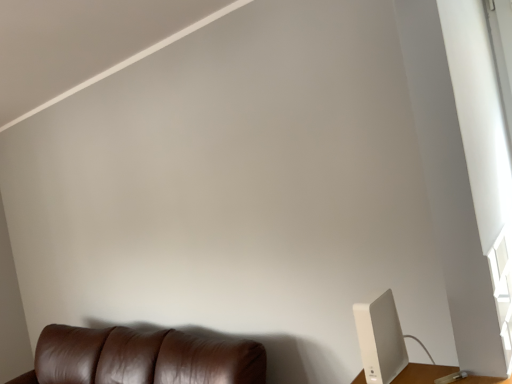
Question: Would you say white plastic router at lower right is outside brown leather couch at lower left?

Choices:
 (A) no
 (B) yes

Answer: (B)

Question: Is white plastic router at lower right looking in the opposite direction of brown leather couch at lower left?

Choices:
 (A) no
 (B) yes

Answer: (A)

Question: Is white plastic router at lower right wider than brown leather couch at lower left?

Choices:
 (A) yes
 (B) no

Answer: (B)

Question: Is white plastic router at lower right next to brown leather couch at lower left and touching it?

Choices:
 (A) yes
 (B) no

Answer: (B)

Question: From a real-world perspective, is white plastic router at lower right beneath brown leather couch at lower left?

Choices:
 (A) no
 (B) yes

Answer: (A)

Question: Is white plastic router at lower right at the right side of brown leather couch at lower left?

Choices:
 (A) yes
 (B) no

Answer: (A)

Question: Would you say white plastic router at lower right is part of brown leather couch at lower left's contents?

Choices:
 (A) yes
 (B) no

Answer: (B)

Question: From a real-world perspective, does brown leather couch at lower left sit lower than white plastic router at lower right?

Choices:
 (A) no
 (B) yes

Answer: (B)

Question: Would you say brown leather couch at lower left is outside white plastic router at lower right?

Choices:
 (A) yes
 (B) no

Answer: (A)

Question: Is the position of brown leather couch at lower left more distant than that of white plastic router at lower right?

Choices:
 (A) no
 (B) yes

Answer: (B)

Question: Can you confirm if brown leather couch at lower left is positioned to the left of white plastic router at lower right?

Choices:
 (A) no
 (B) yes

Answer: (B)

Question: Is there a large distance between brown leather couch at lower left and white plastic router at lower right?

Choices:
 (A) no
 (B) yes

Answer: (B)

Question: From the image's perspective, is white plastic router at lower right above or below brown leather couch at lower left?

Choices:
 (A) above
 (B) below

Answer: (A)